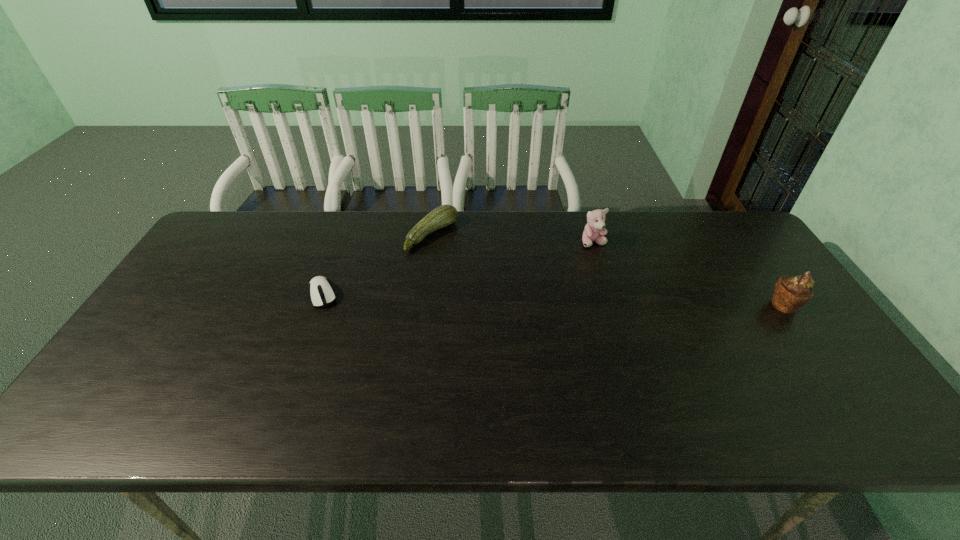
Find the location of a particular element. The width and height of the screenshot is (960, 540). mouse is located at coordinates (321, 292).

At what (x,y) coordinates should I click in order to perform the action: click on the leftmost object. Please return your answer as a coordinate pair (x, y). Image resolution: width=960 pixels, height=540 pixels. Looking at the image, I should click on (321, 292).

You are a GUI agent. You are given a task and a screenshot of the screen. Output one action in this format:
    pyautogui.click(x=<x>, y=<y>)
    Task: Click on the rightmost object
    
    Given the screenshot: What is the action you would take?
    pyautogui.click(x=791, y=293)

I want to click on teddy bear, so click(594, 230).

Where is `zucchini`? The width and height of the screenshot is (960, 540). zucchini is located at coordinates (444, 215).

Locate an element on the screen. the second object from left to right is located at coordinates (444, 215).

You are a GUI agent. You are given a task and a screenshot of the screen. Output one action in this format:
    pyautogui.click(x=<x>, y=<y>)
    Task: Click on the vacant position located 0.160m on the left of the leftmost object
    The height and width of the screenshot is (540, 960).
    Given the screenshot: What is the action you would take?
    pyautogui.click(x=251, y=294)

The image size is (960, 540). I want to click on vacant space situated 0.170m on the back of the rightmost object, so click(x=750, y=255).

This screenshot has height=540, width=960. Find the location of `blank space located 0.150m at the face of the second object from right to left`. blank space located 0.150m at the face of the second object from right to left is located at coordinates (602, 282).

The image size is (960, 540). Identify the location of free location located at the face of the second object from right to left. (601, 280).